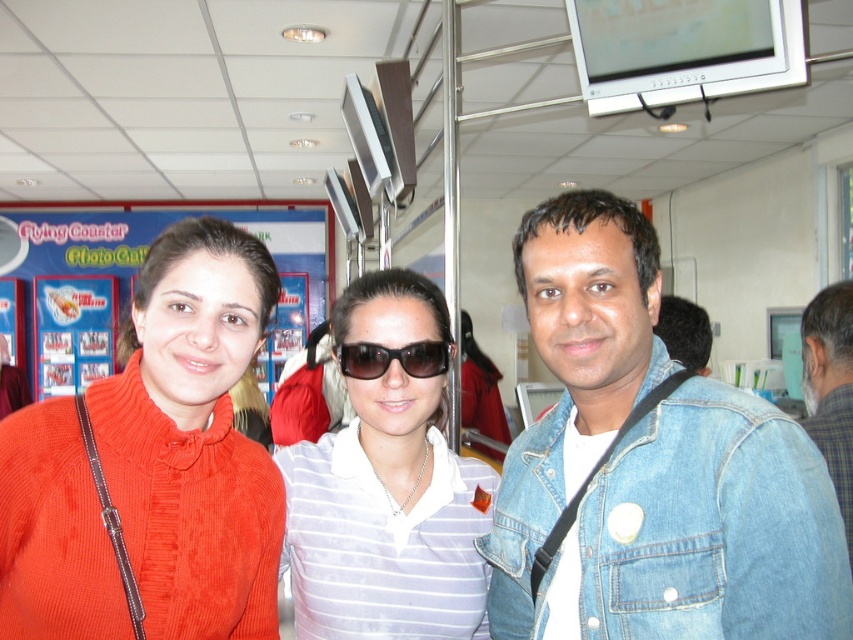
Image resolution: width=853 pixels, height=640 pixels. I want to click on gray checkered shirt at right, so click(x=830, y=387).

This screenshot has width=853, height=640. Identify the location of gray checkered shirt at right. (830, 387).

Consider the image. Does matte red sweater at left appear on the right side of denim jacket at lower right?

In fact, matte red sweater at left is to the left of denim jacket at lower right.

Is point (523, 545) less distant than point (701, 548)?

No, it is not.

Locate an element on the screen. matte red sweater at left is located at coordinates (654, 465).

Is point (685, 524) positioned after point (482, 625)?

No, it is not.

Is matte red sweater at left above white striped shirt at center?

Correct, matte red sweater at left is located above white striped shirt at center.

Identify the location of matte red sweater at left. The height and width of the screenshot is (640, 853). (654, 465).